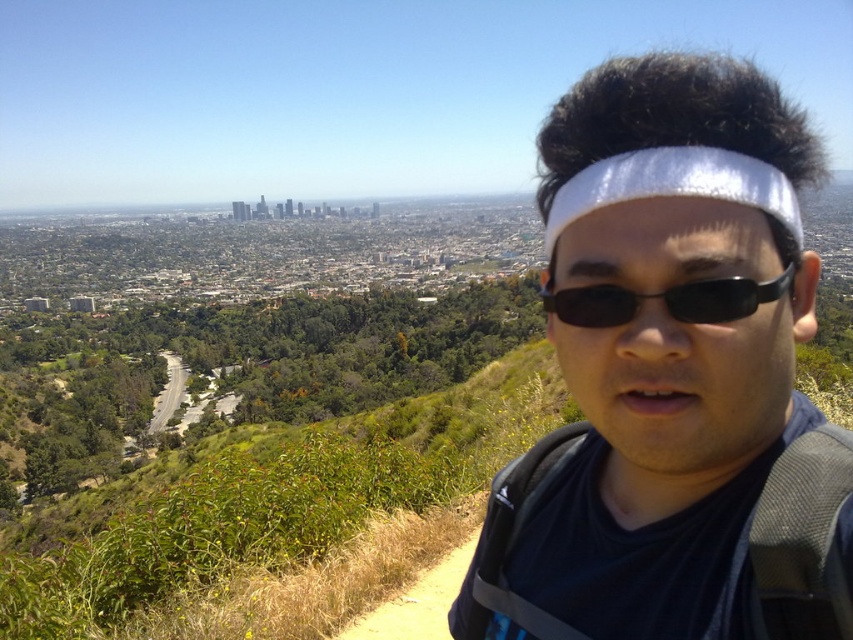
You are a photographer trying to capture the scenic view while ensuring both the white reflective headband at center and the white matte headband at center are visible in the frame. Which headband appears to the left of the other?

The white reflective headband at center is positioned on the left side of the white matte headband at center, so it appears to the left of the other.